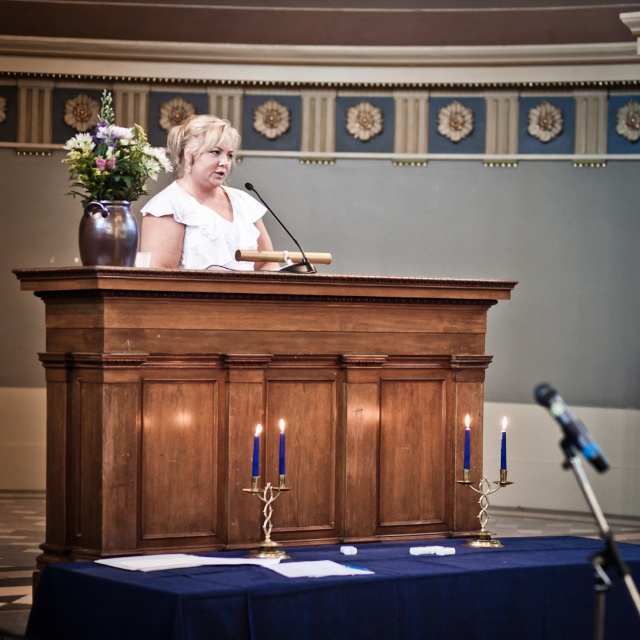
You are a speaker who needs to adjust the microphone stand to ensure it reaches the height of the wooden table at center. Currently, the black metallic microphone at lower right is positioned lower than the table. How should you adjust the microphone stand?

The wooden table at center has a greater height compared to the black metallic microphone at lower right. To adjust the microphone stand, you should raise it to match the table height so the speaker can reach it comfortably.

You are an event planner setting up for a ceremony. You have a wooden table at center and a blue fabric table at center. Which one is placed higher in the scene?

The wooden table at center is located above the blue fabric table at center, meaning it is placed higher in the scene.

You are attending this event and need to determine the relative positions of two points marked in the image. Which point is closer to you, point at coordinate (113, 573) or point at coordinate (545, 388)?

Point at coordinate (113, 573) is closer to the viewer than point at coordinate (545, 388).